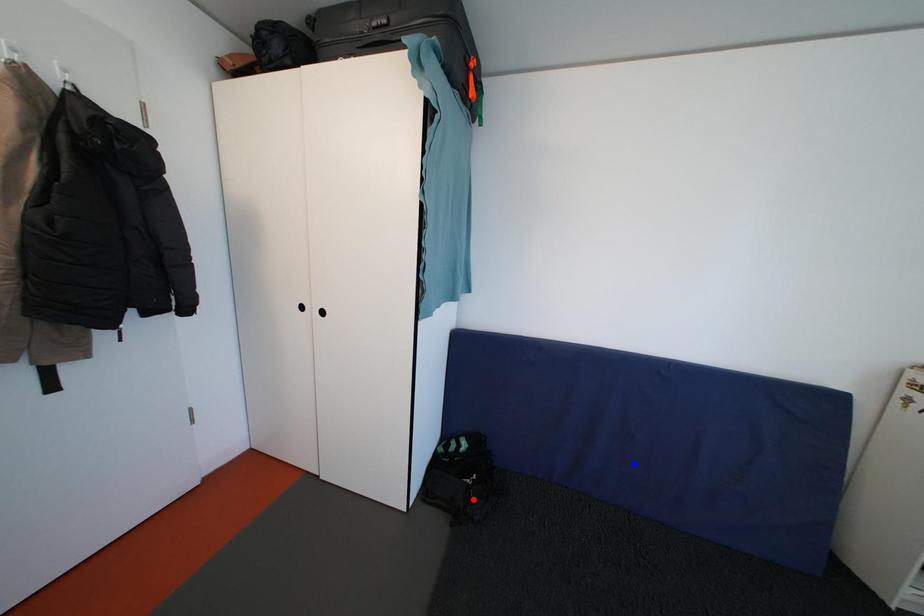
Question: Which of the two points in the image is closer to the camera?

Choices:
 (A) Blue point is closer.
 (B) Red point is closer.

Answer: (A)